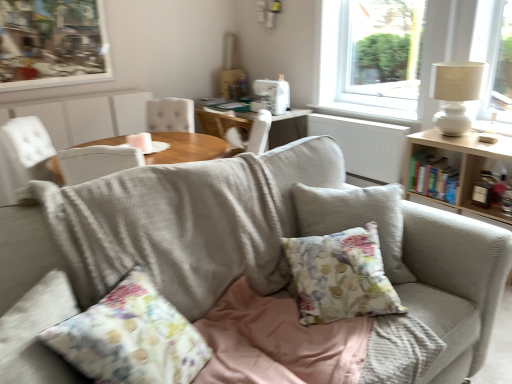
Question: Does white fabric chair at center have a larger size compared to white ceramic table lamp at upper right?

Choices:
 (A) yes
 (B) no

Answer: (A)

Question: Considering the relative sizes of white fabric chair at center and white ceramic table lamp at upper right in the image provided, is white fabric chair at center shorter than white ceramic table lamp at upper right?

Choices:
 (A) yes
 (B) no

Answer: (A)

Question: From the image's perspective, is white fabric chair at center under white ceramic table lamp at upper right?

Choices:
 (A) no
 (B) yes

Answer: (A)

Question: Does white fabric chair at center have a greater width compared to white ceramic table lamp at upper right?

Choices:
 (A) yes
 (B) no

Answer: (B)

Question: Is white fabric chair at center oriented away from white ceramic table lamp at upper right?

Choices:
 (A) yes
 (B) no

Answer: (B)

Question: Looking at the image, does floral fabric cushion at center seem bigger or smaller compared to wooden picture frame at upper left?

Choices:
 (A) big
 (B) small

Answer: (A)

Question: From the image's perspective, is floral fabric cushion at center above or below wooden picture frame at upper left?

Choices:
 (A) below
 (B) above

Answer: (A)

Question: From a real-world perspective, is floral fabric cushion at center physically located above or below wooden picture frame at upper left?

Choices:
 (A) below
 (B) above

Answer: (A)

Question: Is floral fabric cushion at center taller or shorter than wooden picture frame at upper left?

Choices:
 (A) short
 (B) tall

Answer: (A)

Question: From the image's perspective, is floral fabric cushion at center above or below white fabric chair at center?

Choices:
 (A) below
 (B) above

Answer: (A)

Question: Would you say floral fabric cushion at center is to the left or to the right of white fabric chair at center in the picture?

Choices:
 (A) left
 (B) right

Answer: (B)

Question: Is point (353, 241) closer or farther from the camera than point (209, 114)?

Choices:
 (A) closer
 (B) farther

Answer: (A)

Question: Is floral fabric cushion at center inside the boundaries of white fabric chair at center, or outside?

Choices:
 (A) outside
 (B) inside

Answer: (A)

Question: Is white ceramic table lamp at upper right bigger or smaller than wooden table at right?

Choices:
 (A) small
 (B) big

Answer: (A)

Question: In terms of width, does white ceramic table lamp at upper right look wider or thinner when compared to wooden table at right?

Choices:
 (A) wide
 (B) thin

Answer: (B)